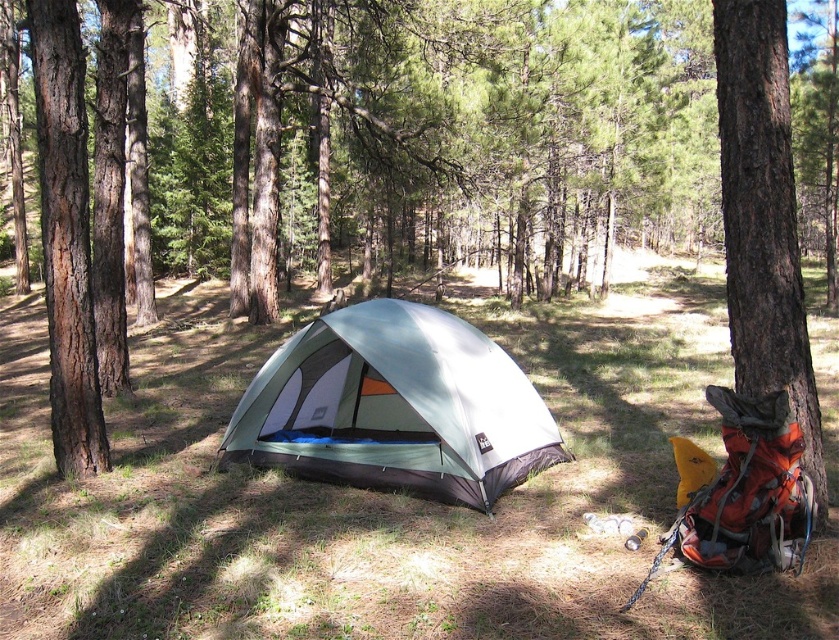
Does green fabric tent at center have a greater width compared to brown rough bark tree at right?

Yes.

Who is more distant from viewer, [543,460] or [782,28]?

The point [543,460] is behind.

Is point (423, 321) farther from viewer compared to point (784, 173)?

Yes, it is.

Where is `green fabric tent at center`? The height and width of the screenshot is (640, 839). green fabric tent at center is located at coordinates (395, 406).

Is point (233, 452) farther from viewer compared to point (35, 36)?

Yes, point (233, 452) is behind point (35, 36).

What do you see at coordinates (395, 406) in the screenshot?
I see `green fabric tent at center` at bounding box center [395, 406].

The width and height of the screenshot is (839, 640). What are the coordinates of `green fabric tent at center` in the screenshot? It's located at (395, 406).

Is brown rough bark tree at right in front of brown rough bark tree at left?

That is True.

Who is higher up, brown rough bark tree at right or brown rough bark tree at left?

Positioned higher is brown rough bark tree at left.

Is point (784, 35) positioned behind point (50, 132)?

No, (784, 35) is closer to viewer.

What are the coordinates of `brown rough bark tree at right` in the screenshot? It's located at (763, 218).